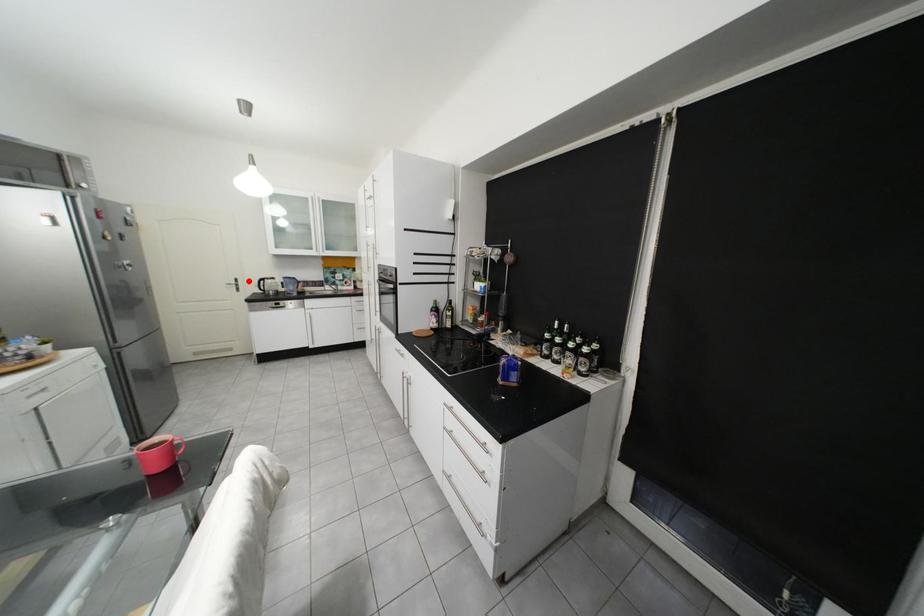
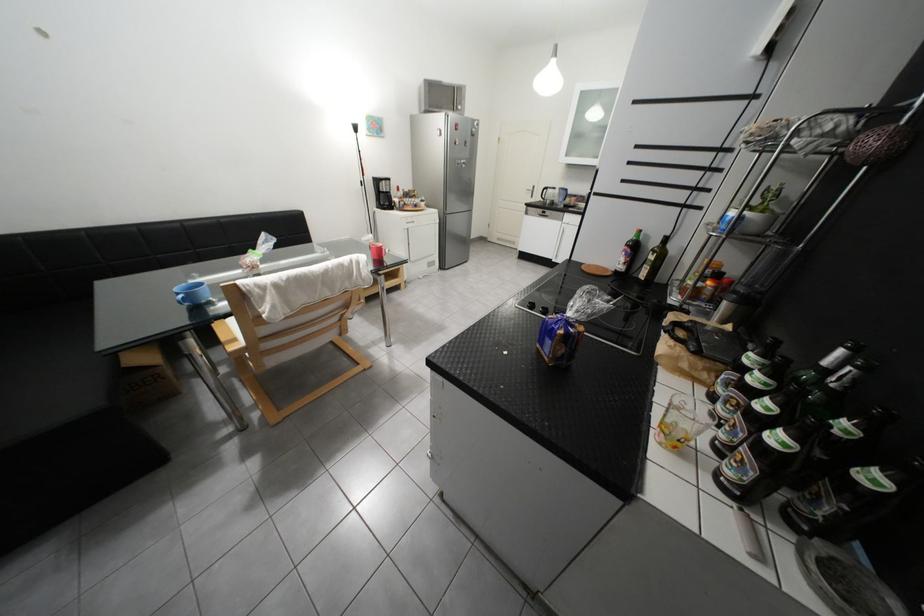
Question: I am providing you with two images of the same scene from different viewpoints. A red point is shown in image1. For the corresponding object point in image2, is it positioned nearer or farther from the camera?

Choices:
 (A) Nearer
 (B) Farther

Answer: (A)